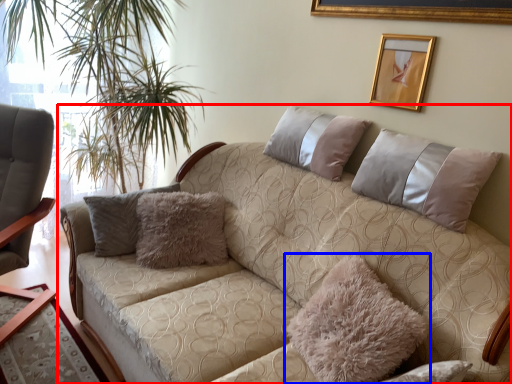
Question: Which object appears closest to the camera in this image, studio couch (highlighted by a red box) or pillow (highlighted by a blue box)?

Choices:
 (A) studio couch
 (B) pillow

Answer: (A)